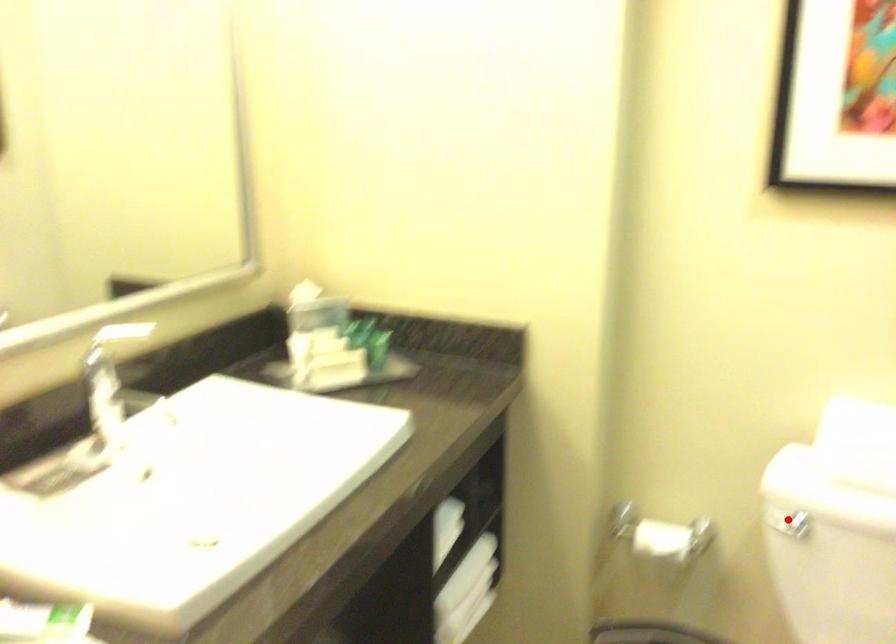
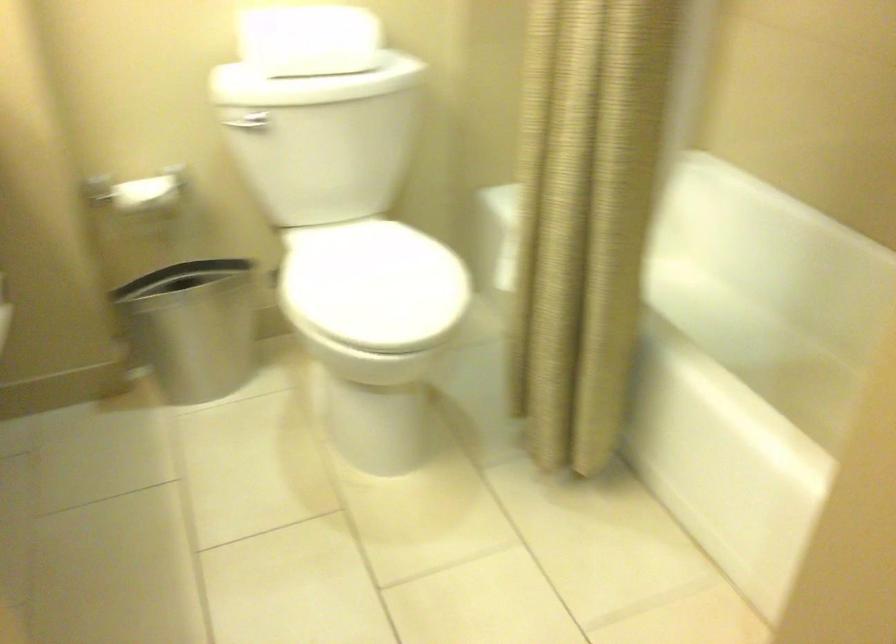
The point at the highlighted location is marked in the first image. Where is the corresponding point in the second image?

(247, 122)